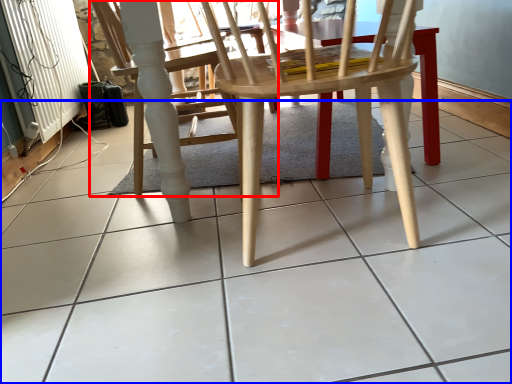
Question: Which point is further to the camera, chair (highlighted by a red box) or ceramic tile (highlighted by a blue box)?

Choices:
 (A) chair
 (B) ceramic tile

Answer: (A)